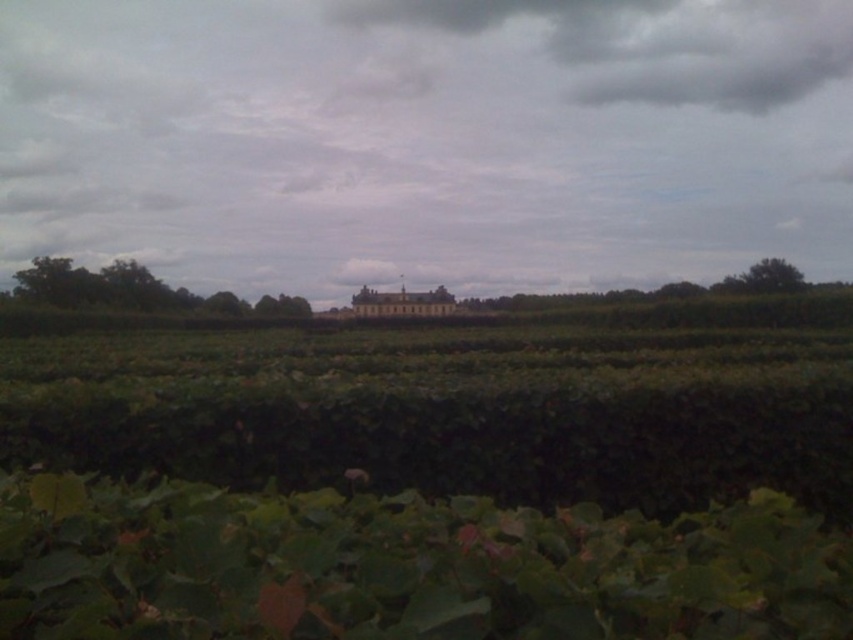
Question: Estimate the real-world distances between objects in this image. Which object is farther from the green leafy vegetation at center?

Choices:
 (A) golden stone palace at center
 (B) gray fluffy cloud at upper center

Answer: (B)

Question: Can you confirm if gray fluffy cloud at upper center is positioned to the right of golden stone palace at center?

Choices:
 (A) no
 (B) yes

Answer: (B)

Question: Which object appears closest to the camera in this image?

Choices:
 (A) golden stone palace at center
 (B) green leafy vegetation at center
 (C) gray fluffy cloud at upper center

Answer: (B)

Question: Is gray fluffy cloud at upper center wider than golden stone palace at center?

Choices:
 (A) no
 (B) yes

Answer: (B)

Question: Estimate the real-world distances between objects in this image. Which object is closer to the golden stone palace at center?

Choices:
 (A) green leafy vegetation at center
 (B) gray fluffy cloud at upper center
 (C) gray cloudy sky at center

Answer: (A)

Question: Is gray cloudy sky at center to the left of gray fluffy cloud at upper center from the viewer's perspective?

Choices:
 (A) yes
 (B) no

Answer: (A)